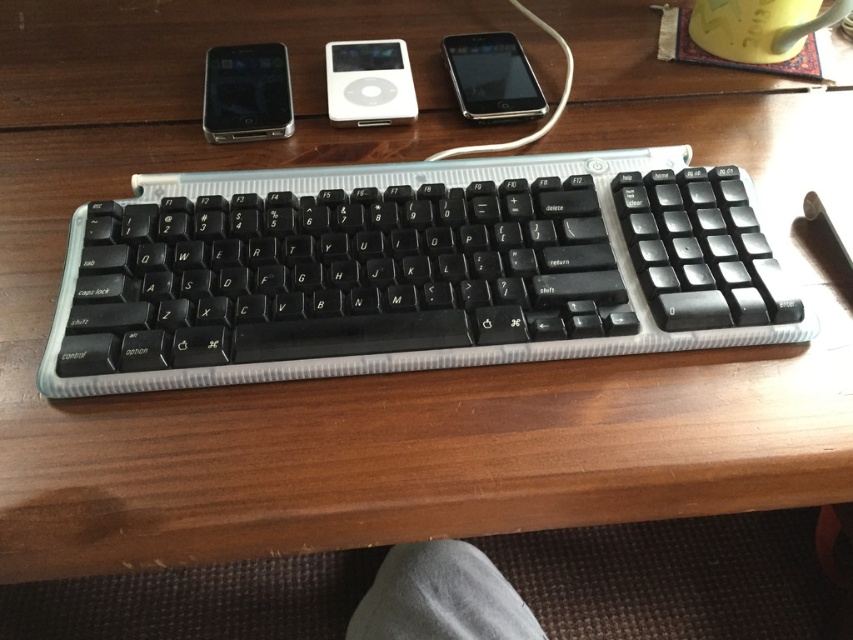
Measure the distance between black plastic keyboard at center and camera.

They are 17.02 inches apart.

Between point (252, 211) and point (288, 125), which one is positioned in front?

Point (252, 211) is in front.

Between point (628, 204) and point (219, 134), which one is positioned in front?

Point (628, 204) is in front.

You are a GUI agent. You are given a task and a screenshot of the screen. Output one action in this format:
    pyautogui.click(x=<x>, y=<y>)
    Task: Click on the black plastic keyboard at center
    The width and height of the screenshot is (853, 640).
    Given the screenshot: What is the action you would take?
    pyautogui.click(x=410, y=272)

Is black plastic keyboard at center smaller than sleek black smartphone at center?

Actually, black plastic keyboard at center might be larger than sleek black smartphone at center.

Who is higher up, black plastic keyboard at center or sleek black smartphone at center?

sleek black smartphone at center is above.

This screenshot has height=640, width=853. Find the location of `black plastic keyboard at center`. black plastic keyboard at center is located at coordinates pos(410,272).

In order to click on black plastic keyboard at center in this screenshot , I will do `click(410, 272)`.

Is matte black smartphone at upper left wider than white glossy ipod at center?

Indeed, matte black smartphone at upper left has a greater width compared to white glossy ipod at center.

Which is behind, point (233, 97) or point (358, 106)?

The point (233, 97) is more distant.

Describe the element at coordinates (247, 93) in the screenshot. The width and height of the screenshot is (853, 640). I see `matte black smartphone at upper left` at that location.

The height and width of the screenshot is (640, 853). Find the location of `matte black smartphone at upper left`. matte black smartphone at upper left is located at coordinates (247, 93).